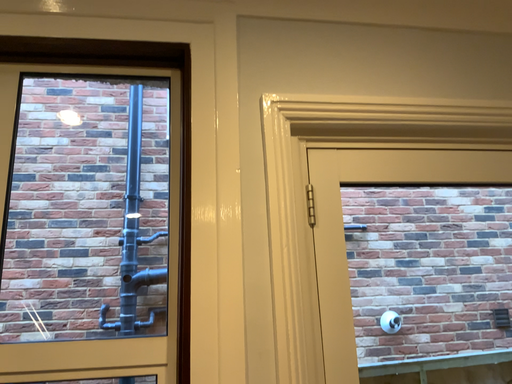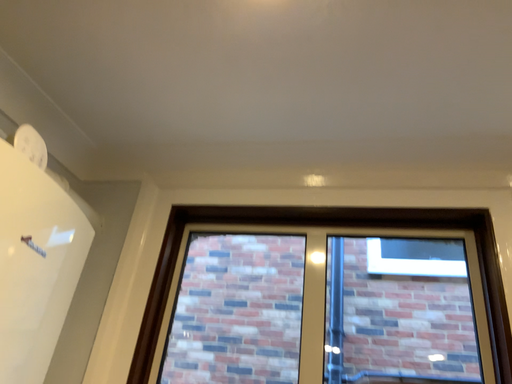
Question: Which way did the camera rotate in the video?

Choices:
 (A) rotated left
 (B) rotated right

Answer: (A)